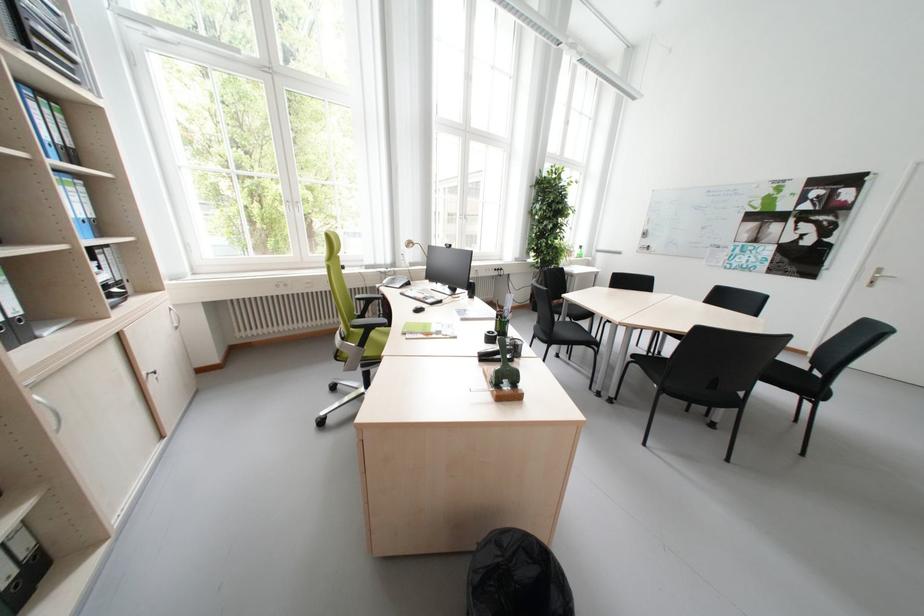
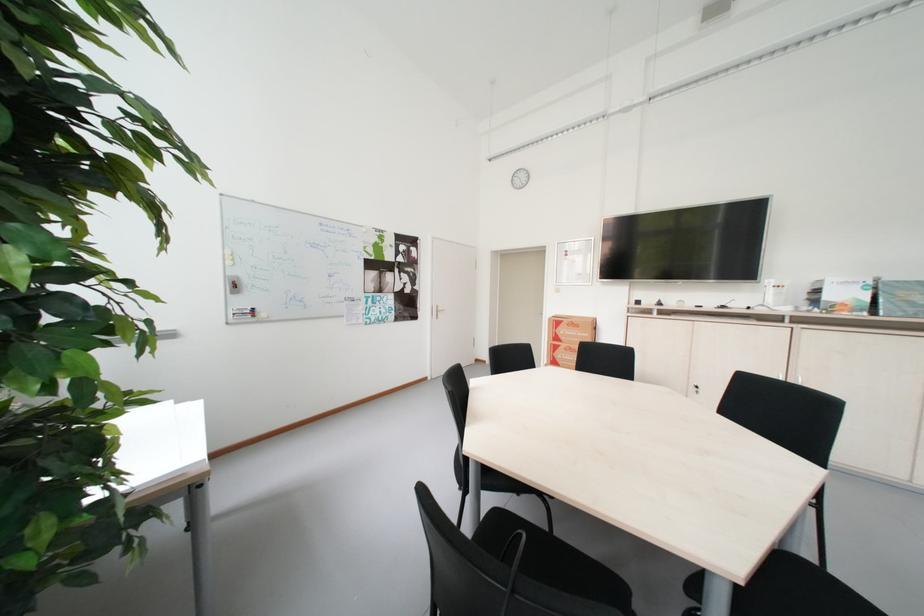
Locate, in the second image, the point that corresponds to point (853, 264) in the first image.

(434, 305)